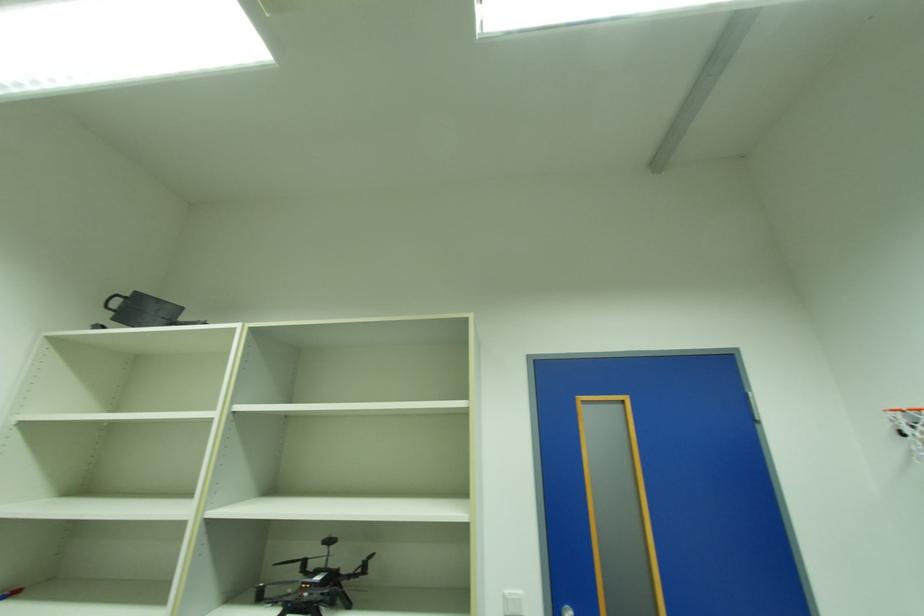
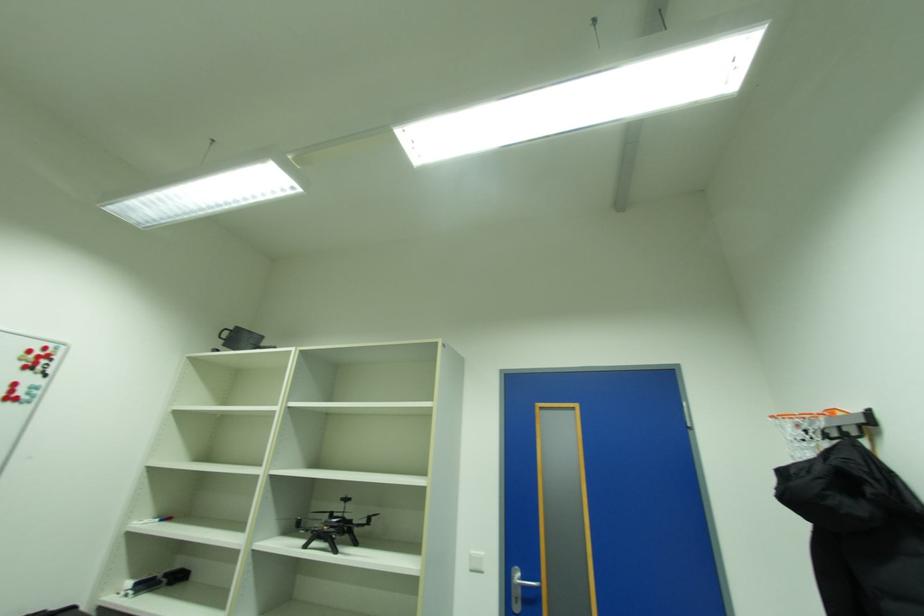
Question: How did the camera likely rotate?

Choices:
 (A) Left
 (B) Right
 (C) Up
 (D) Down

Answer: (A)